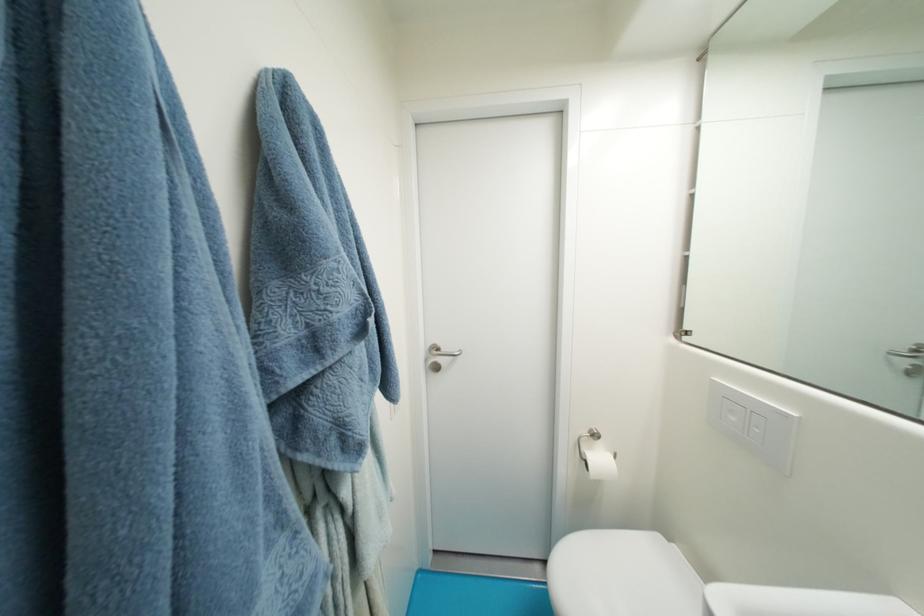
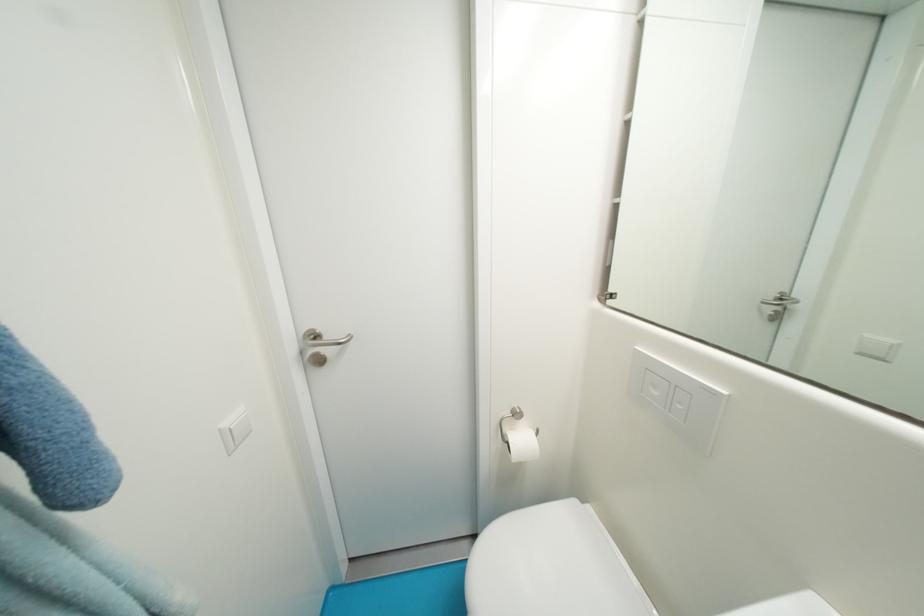
Question: The camera is either moving clockwise (left) or counter-clockwise (right) around the object. The first image is from the beginning of the video and the second image is from the end. Is the camera moving left or right when shooting the video?

Choices:
 (A) Left
 (B) Right

Answer: (A)